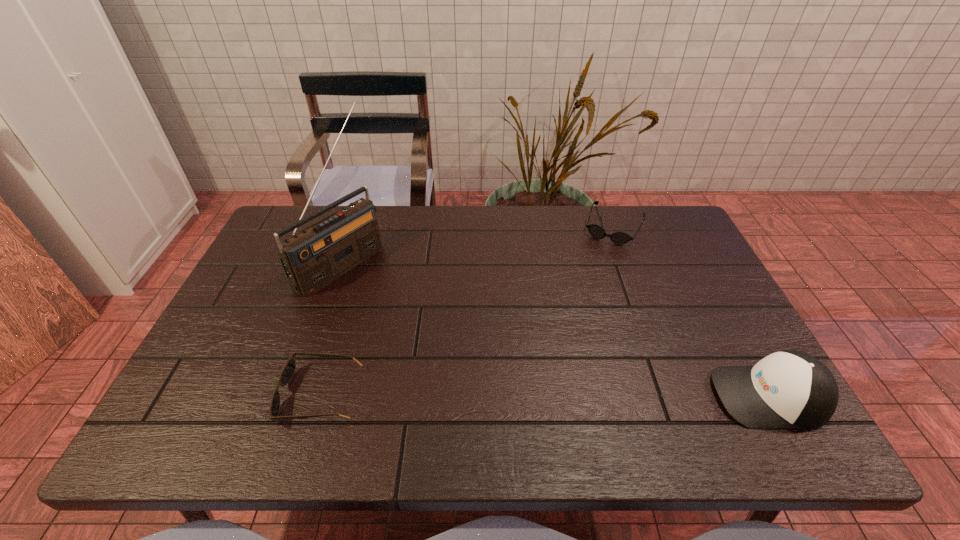
This screenshot has height=540, width=960. Find the location of `vacant space located on the front-facing side of the tallest object`. vacant space located on the front-facing side of the tallest object is located at coordinates (382, 294).

You are a GUI agent. You are given a task and a screenshot of the screen. Output one action in this format:
    pyautogui.click(x=<x>, y=<y>)
    Task: Click on the free region located on the front-facing side of the tallest object
    Image resolution: width=960 pixels, height=540 pixels.
    Given the screenshot: What is the action you would take?
    click(376, 291)

Identify the location of free space located 0.400m on the front-facing side of the tallest object. The image size is (960, 540). (474, 356).

Identify the location of blank space located on the lenses of the farther sunglasses. (567, 329).

You are a GUI agent. You are given a task and a screenshot of the screen. Output one action in this format:
    pyautogui.click(x=<x>, y=<y>)
    Task: Click on the free space located on the lenses of the farther sunglasses
    Image resolution: width=960 pixels, height=540 pixels.
    Given the screenshot: What is the action you would take?
    pyautogui.click(x=576, y=310)

Where is `vacant position located 0.140m on the lenses of the farther sunglasses`? vacant position located 0.140m on the lenses of the farther sunglasses is located at coordinates (593, 272).

In order to click on radio receiver that is at the far edge in this screenshot , I will do `click(314, 257)`.

The height and width of the screenshot is (540, 960). Find the location of `sunglasses that is at the far edge`. sunglasses that is at the far edge is located at coordinates (619, 237).

Where is `sunglasses that is at the near edge`? Image resolution: width=960 pixels, height=540 pixels. sunglasses that is at the near edge is located at coordinates (288, 370).

Where is `cap located in the near edge section of the desktop`? This screenshot has width=960, height=540. cap located in the near edge section of the desktop is located at coordinates (789, 389).